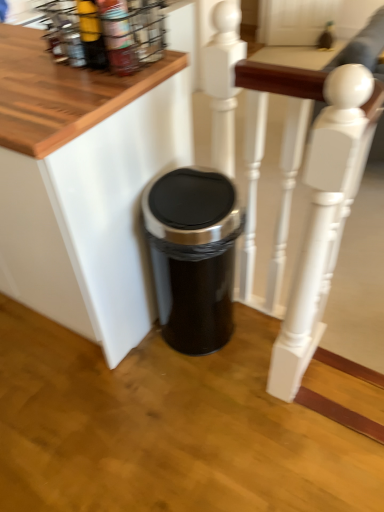
You are a GUI agent. You are given a task and a screenshot of the screen. Output one action in this format:
    pyautogui.click(x=<x>, y=<y>)
    Task: Click on the vacant area situated to the left side of metallic wire spice rack at upper left
    This screenshot has height=512, width=384.
    Given the screenshot: What is the action you would take?
    pyautogui.click(x=31, y=66)